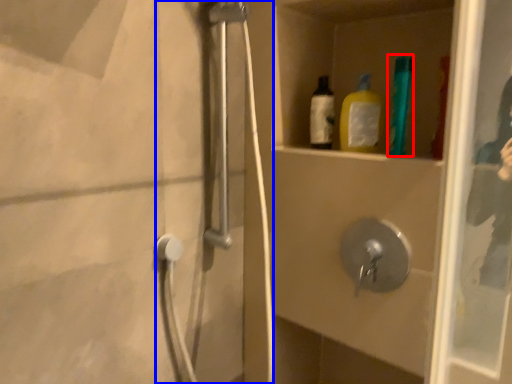
Question: Which object is further to the camera taking this photo, bottle (highlighted by a red box) or shower door (highlighted by a blue box)?

Choices:
 (A) bottle
 (B) shower door

Answer: (A)